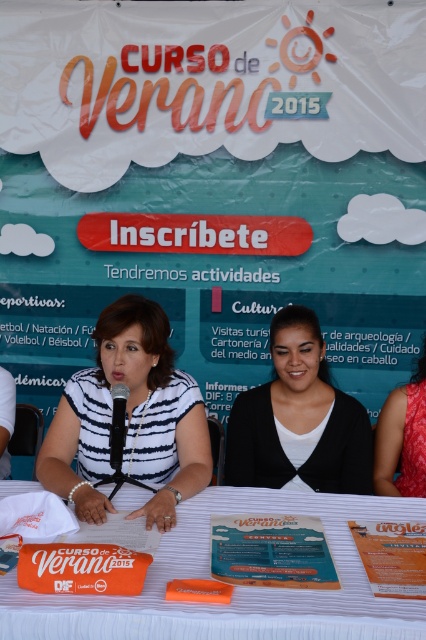
Does white fabric table at center have a smaller size compared to white striped shirt at left?

No.

Based on the photo, is white fabric table at center shorter than white striped shirt at left?

Correct, white fabric table at center is not as tall as white striped shirt at left.

Where is `white fabric table at center`? The width and height of the screenshot is (426, 640). white fabric table at center is located at coordinates (235, 588).

Who is positioned more to the left, white striped shirt at center or matte black sweater at center?

Positioned to the left is white striped shirt at center.

Is the position of white striped shirt at center less distant than that of matte black sweater at center?

Yes, it is in front of matte black sweater at center.

Which is in front, point (181, 397) or point (345, 396)?

Positioned in front is point (181, 397).

The height and width of the screenshot is (640, 426). I want to click on white striped shirt at center, so click(129, 419).

From the picture: Who is more distant from viewer, (281, 333) or (396, 452)?

Point (396, 452)

Can you confirm if matte black sweater at center is smaller than red satin dress at right?

Incorrect, matte black sweater at center is not smaller in size than red satin dress at right.

Does point (273, 467) come farther from viewer compared to point (402, 460)?

That is False.

Locate an element on the screen. matte black sweater at center is located at coordinates (299, 419).